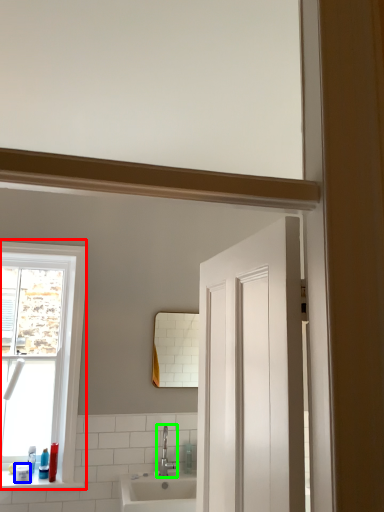
Question: Which object is positioned farthest from window (highlighted by a red box)? Select from toiletry (highlighted by a blue box) and tap (highlighted by a green box).

Choices:
 (A) toiletry
 (B) tap

Answer: (B)